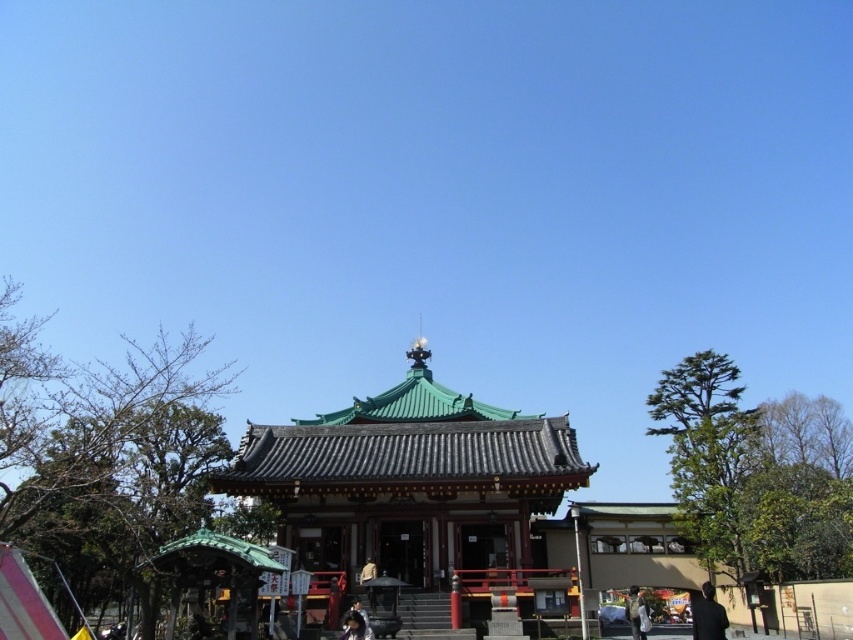
You are a photographer standing at the base of the temple steps. You want to capture a photo that includes both the green tile roof pagoda at center and the black fabric person at lower right. Considering their sizes, which object should you position closer to the camera to ensure both are visible in the frame?

The green tile roof pagoda at center is larger than the black fabric person at lower right. To ensure both are visible in the frame, you should position the black fabric person at lower right closer to the camera since it is smaller, allowing the larger pagoda to fit in the background without overwhelming the shot.

Consider the image. You are standing at the entrance of the temple and want to place a camouflage fabric jacket at lower right near the green tile roof pagoda at center. Based on their positions, which direction should you move to place the jacket closer to the pagoda?

The green tile roof pagoda at center is to the left of the camouflage fabric jacket at lower right, so you should move the jacket to the left to place it closer to the pagoda.

You are standing at the base of the temple steps. Looking up, you see the green tile roof pagoda at center and the black fabric person at lower right. Which object is positioned higher in the image?

The green tile roof pagoda at center is positioned higher than the black fabric person at lower right.